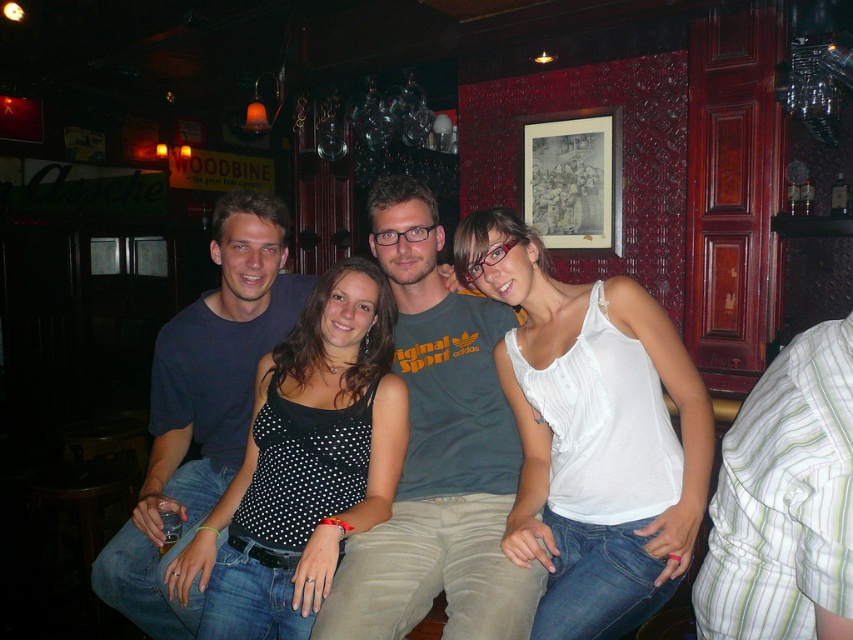
You are standing at the entrance of the bar and see two points marked in the scene. The first point is labeled as point (299, 445) and the second is point (277, 305). Which point is closer to you?

Point (299, 445) is in front of point (277, 305), so it is closer to you.